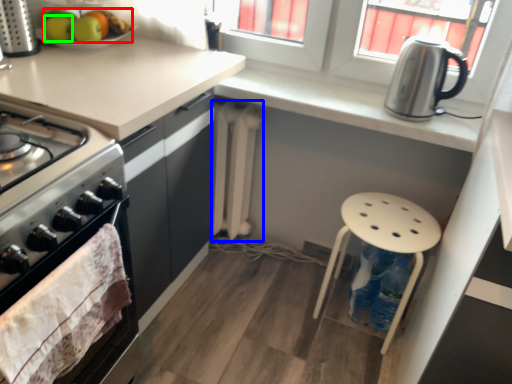
Question: Which object is positioned farthest from fruit (highlighted by a red box)? Select from radiator (highlighted by a blue box) and apple (highlighted by a green box).

Choices:
 (A) radiator
 (B) apple

Answer: (A)